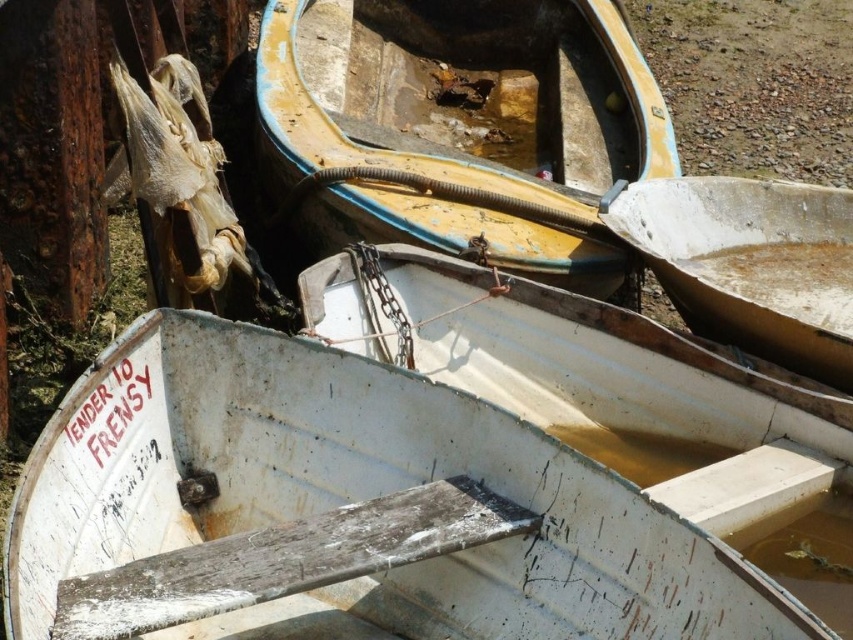
Does point (660, 188) come behind point (743, 1)?

No, (660, 188) is in front of (743, 1).

Is white matte boat at center to the left of brown gravel at upper right from the viewer's perspective?

Yes, white matte boat at center is to the left of brown gravel at upper right.

Is point (677, 285) positioned after point (833, 154)?

No, it is in front of (833, 154).

Find the location of a particular element. Image resolution: width=853 pixels, height=640 pixels. white matte boat at center is located at coordinates pos(750,262).

Who is taller, white weathered wood boat at center or white matte boat at center?

white weathered wood boat at center is taller.

In the scene shown: Which of these two, white weathered wood boat at center or white matte boat at center, stands shorter?

white matte boat at center is shorter.

At what (x,y) coordinates should I click in order to perform the action: click on white weathered wood boat at center. Please return your answer as a coordinate pair (x, y). This screenshot has height=640, width=853. Looking at the image, I should click on (341, 512).

Identify the location of white weathered wood boat at center. The width and height of the screenshot is (853, 640). pyautogui.click(x=341, y=512).

Which is behind, point (608, 586) or point (788, 120)?

Point (788, 120)

Identify the location of white weathered wood boat at center. (341, 512).

Who is more forward, (357,516) or (677,118)?

Point (357,516) is more forward.

I want to click on white weathered wood boat at center, so click(341, 512).